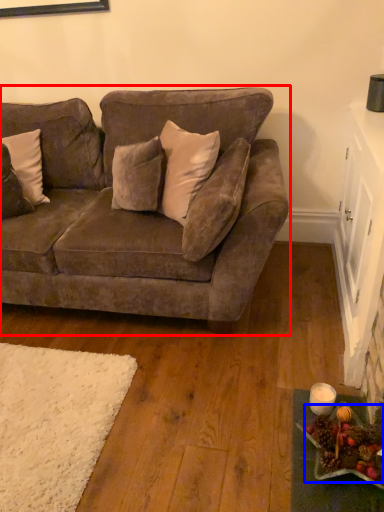
Question: Which point is closer to the camera, studio couch (highlighted by a red box) or food (highlighted by a blue box)?

Choices:
 (A) studio couch
 (B) food

Answer: (B)